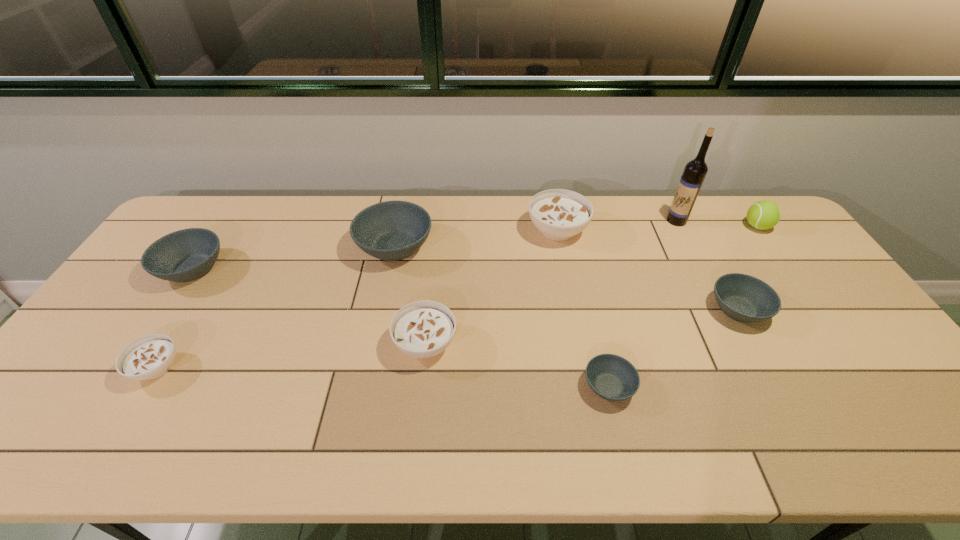
Locate an element on the screen. The height and width of the screenshot is (540, 960). the third biggest gray soup bowl is located at coordinates (744, 298).

Identify the location of the smallest white soup bowl. (149, 357).

I want to click on the third gray soup bowl from left to right, so click(612, 377).

This screenshot has width=960, height=540. In order to click on the shortest soup bowl in this screenshot , I will do `click(612, 377)`.

Locate an element on the screen. This screenshot has height=540, width=960. vacant space located 0.100m on the label of the wine bottle is located at coordinates (638, 221).

Find the location of `free space located on the label of the wine bottle`. free space located on the label of the wine bottle is located at coordinates (598, 221).

I want to click on vacant area situated 0.080m on the label of the wine bottle, so click(x=643, y=221).

In order to click on vacant area located on the front of the farthest white soup bowl in this screenshot , I will do `click(579, 341)`.

Find the location of `blank area located on the left of the rightmost object`. blank area located on the left of the rightmost object is located at coordinates click(x=723, y=226).

Where is `vacant space positioned 0.260m on the left of the biggest gray soup bowl`? vacant space positioned 0.260m on the left of the biggest gray soup bowl is located at coordinates (276, 247).